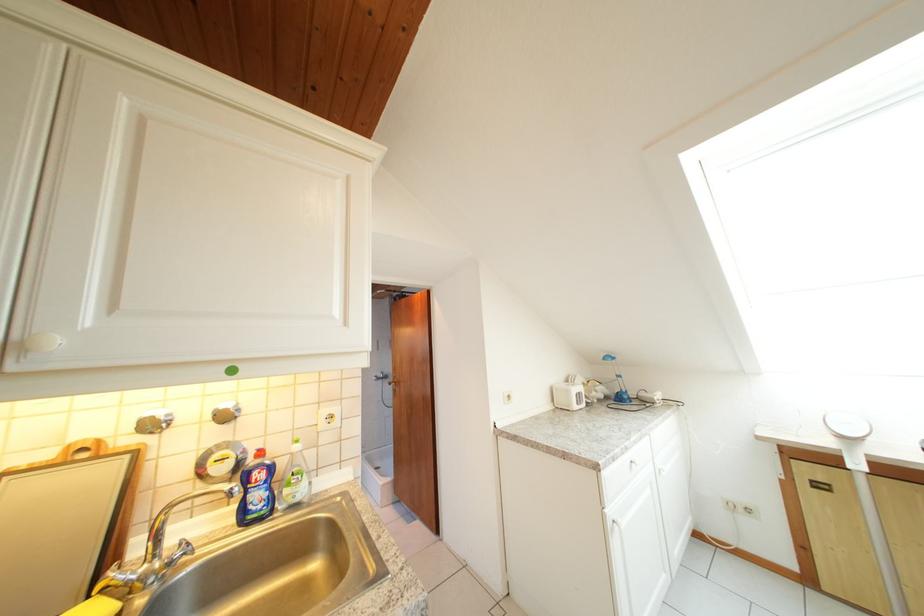
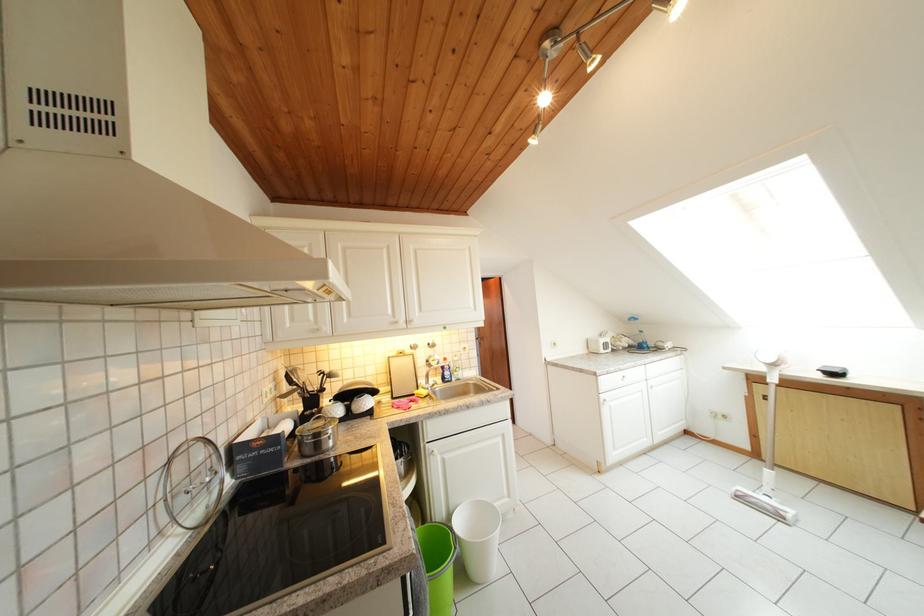
Find the pixel in the second image that matches [254,448] in the first image.

(445, 362)